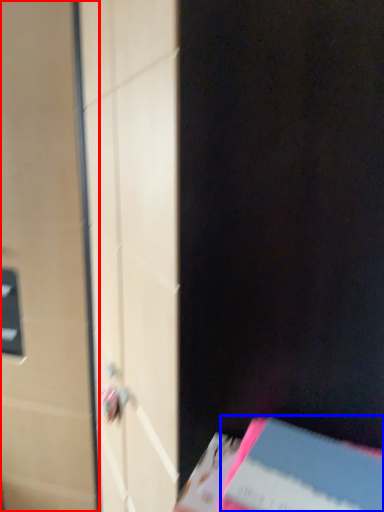
Question: Which of the following is the closest to the observer, door (highlighted by a red box) or paperback book (highlighted by a blue box)?

Choices:
 (A) door
 (B) paperback book

Answer: (B)